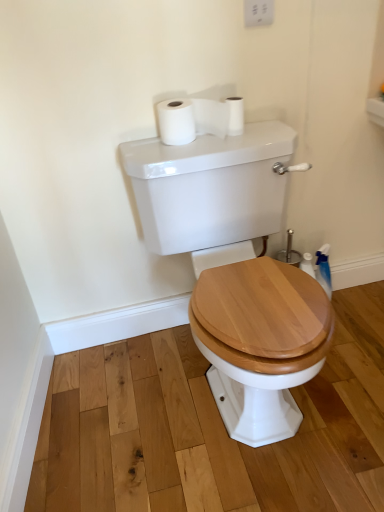
Question: In terms of width, does white glossy porcelain at center look wider or thinner when compared to white matte toilet paper at upper center, which is the first toilet paper from left to right?

Choices:
 (A) wide
 (B) thin

Answer: (A)

Question: Relative to white matte toilet paper at upper center, the second toilet paper in the right-to-left sequence, is white glossy porcelain at center in front or behind?

Choices:
 (A) front
 (B) behind

Answer: (A)

Question: Which of these objects is positioned farthest from the white matte toilet paper at upper center, placed as the 1th toilet paper when sorted from right to left?

Choices:
 (A) white plastic switch at upper center
 (B) white matte toilet paper at upper center, the second toilet paper in the right-to-left sequence
 (C) white glossy porcelain at center

Answer: (C)

Question: Estimate the real-world distances between objects in this image. Which object is closer to the white matte toilet paper at upper center, placed as the 1th toilet paper when sorted from right to left?

Choices:
 (A) white matte toilet paper at upper center, the second toilet paper in the right-to-left sequence
 (B) white plastic switch at upper center
 (C) white glossy porcelain at center

Answer: (A)